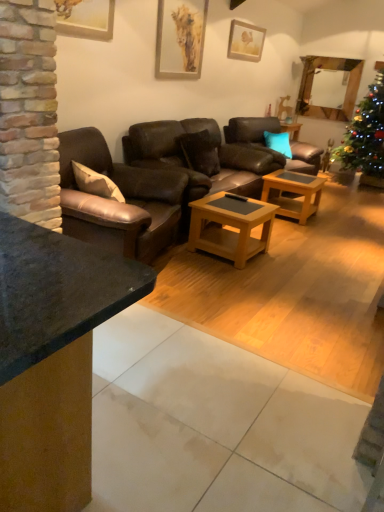
Question: From a real-world perspective, is woodenwoodencoffee table at center, marked as the first coffee table in a left-to-right arrangement, on top of wooden picture frame at upper left, arranged as the 1th picture frame when viewed from the front?

Choices:
 (A) yes
 (B) no

Answer: (B)

Question: From the image's perspective, would you say woodenwoodencoffee table at center, the 1th coffee table in the front-to-back sequence, is positioned over wooden picture frame at upper left, which is the 3th picture frame in right-to-left order?

Choices:
 (A) yes
 (B) no

Answer: (B)

Question: Can we say woodenwoodencoffee table at center, which is the 2th coffee table in back-to-front order, lies outside wooden picture frame at upper left, acting as the third picture frame starting from the back?

Choices:
 (A) yes
 (B) no

Answer: (A)

Question: From the image's perspective, does woodenwoodencoffee table at center, which is the 2th coffee table in back-to-front order, appear lower than wooden picture frame at upper left, arranged as the 1th picture frame when viewed from the front?

Choices:
 (A) yes
 (B) no

Answer: (A)

Question: Would you say wooden picture frame at upper left, arranged as the 1th picture frame when viewed from the front, is part of woodenwoodencoffee table at center, the second coffee table from the right,'s contents?

Choices:
 (A) no
 (B) yes

Answer: (A)

Question: From a real-world perspective, does woodenwoodencoffee table at center, which is the 2th coffee table in back-to-front order, sit lower than wooden picture frame at upper left, arranged as the 1th picture frame when viewed from the front?

Choices:
 (A) no
 (B) yes

Answer: (B)

Question: From a real-world perspective, is brown leather couch at center, which appears as the 1th studio couch when viewed from the back, on top of matte wooden picture frame at upper center, the 1th picture frame viewed from the back?

Choices:
 (A) yes
 (B) no

Answer: (B)

Question: Considering the relative sizes of brown leather couch at center, the second studio couch when ordered from front to back, and matte wooden picture frame at upper center, the 1th picture frame viewed from the right, in the image provided, is brown leather couch at center, the second studio couch when ordered from front to back, shorter than matte wooden picture frame at upper center, the 1th picture frame viewed from the right,?

Choices:
 (A) no
 (B) yes

Answer: (A)

Question: Is brown leather couch at center, the second studio couch when ordered from front to back, directly adjacent to matte wooden picture frame at upper center, the third picture frame from the left?

Choices:
 (A) no
 (B) yes

Answer: (A)

Question: From a real-world perspective, is brown leather couch at center, the second studio couch when ordered from front to back, below matte wooden picture frame at upper center, the 1th picture frame viewed from the right?

Choices:
 (A) no
 (B) yes

Answer: (B)

Question: Considering the relative positions of brown leather couch at center, which appears as the 1th studio couch when viewed from the back, and matte wooden picture frame at upper center, the third picture frame from the left, in the image provided, is brown leather couch at center, which appears as the 1th studio couch when viewed from the back, behind matte wooden picture frame at upper center, the third picture frame from the left,?

Choices:
 (A) yes
 (B) no

Answer: (B)

Question: Is brown leather couch at center, which appears as the 1th studio couch when viewed from the back, at the right side of matte wooden picture frame at upper center, the 1th picture frame viewed from the back?

Choices:
 (A) yes
 (B) no

Answer: (B)

Question: Considering the relative positions of woodenwoodencoffee table at center, which is the 2th coffee table in back-to-front order, and matte gold picture frame at upper center, which is the 2th picture frame from front to back, in the image provided, is woodenwoodencoffee table at center, which is the 2th coffee table in back-to-front order, to the right of matte gold picture frame at upper center, which is the 2th picture frame from front to back, from the viewer's perspective?

Choices:
 (A) yes
 (B) no

Answer: (A)